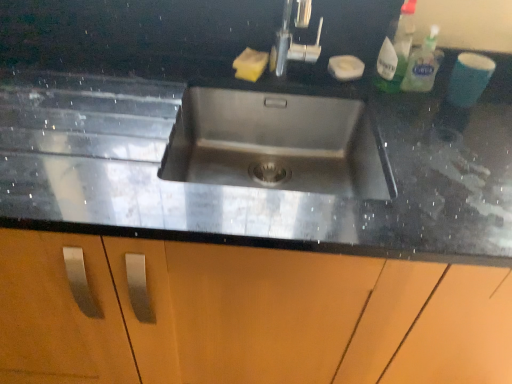
Locate an element on the screen. blank area to the left of yellow sponge at upper center, which ranks as the first soap in left-to-right order is located at coordinates (185, 69).